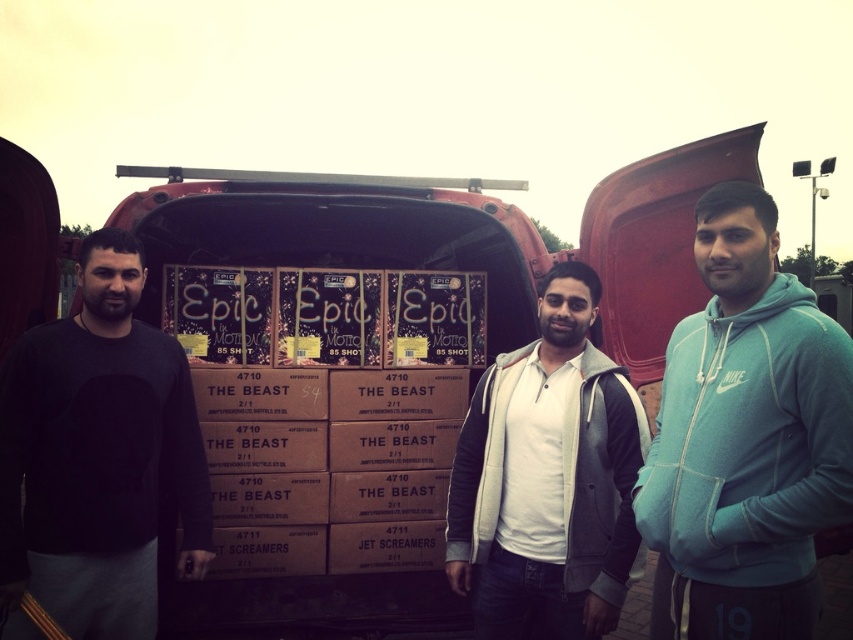
Question: Can you confirm if teal fleece hoodie at center is smaller than black matte sweatshirt at left?

Choices:
 (A) yes
 (B) no

Answer: (A)

Question: Considering the real-world distances, which object is closest to the white fleece jacket at center?

Choices:
 (A) black matte sweatshirt at left
 (B) teal fleece hoodie at center

Answer: (B)

Question: Among these objects, which one is nearest to the camera?

Choices:
 (A) white fleece jacket at center
 (B) teal fleece hoodie at center

Answer: (B)

Question: Is black matte sweatshirt at left to the left of white fleece jacket at center from the viewer's perspective?

Choices:
 (A) no
 (B) yes

Answer: (B)

Question: Considering the real-world distances, which object is closest to the teal fleece hoodie at center?

Choices:
 (A) white fleece jacket at center
 (B) black matte sweatshirt at left

Answer: (A)

Question: Is teal fleece hoodie at center smaller than white fleece jacket at center?

Choices:
 (A) yes
 (B) no

Answer: (B)